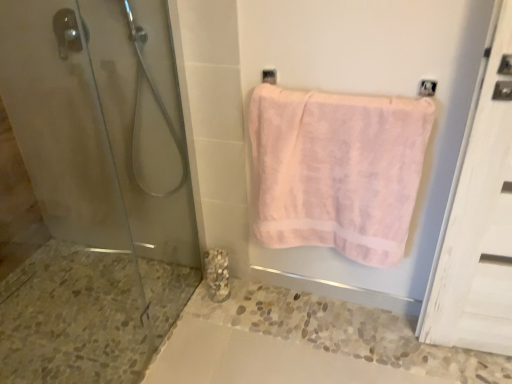
Where is `free region under transparent glass shower door at left (from a real-world perspective)`? free region under transparent glass shower door at left (from a real-world perspective) is located at coordinates (159, 334).